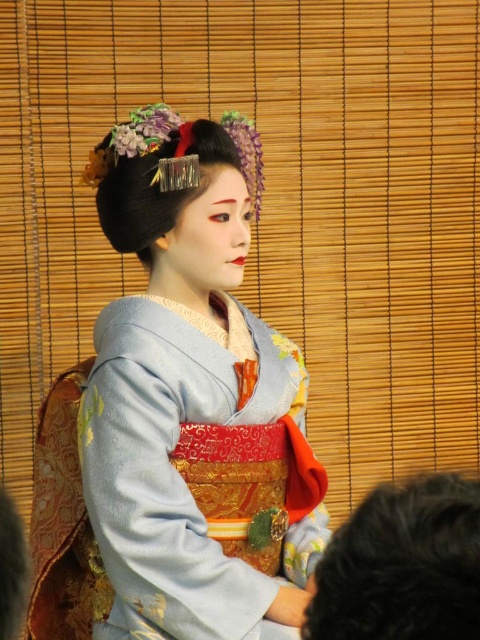
Question: Which point is closer to the camera taking this photo?

Choices:
 (A) click(144, 202)
 (B) click(349, 547)
 (C) click(158, 116)

Answer: (B)

Question: Which object is farther from the camera taking this photo?

Choices:
 (A) satin shiny hairpin at upper center
 (B) silky blue kimono at center

Answer: (A)

Question: Does silky blue kimono at center appear on the right side of satin shiny hairpin at upper center?

Choices:
 (A) yes
 (B) no

Answer: (A)

Question: Is silky blue kimono at center smaller than black curly hair at lower right?

Choices:
 (A) yes
 (B) no

Answer: (B)

Question: Which object is positioned farthest from the satin shiny hairpin at upper center?

Choices:
 (A) silky blue kimono at center
 (B) black curly hair at lower right

Answer: (B)

Question: Is black curly hair at lower right wider than satin shiny hairpin at upper center?

Choices:
 (A) no
 (B) yes

Answer: (A)